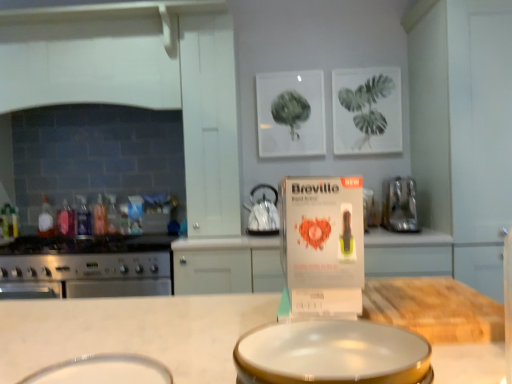
What is the approximate height of translucent plastic bottle at stove left, which is the 2th bottle in right-to-left order?

10.53 inches.

Image resolution: width=512 pixels, height=384 pixels. What do you see at coordinates (83, 218) in the screenshot?
I see `translucent plastic bottle at stove left, which appears as the 3th bottle when viewed from the left` at bounding box center [83, 218].

Identify the location of translucent plastic bottle at left, positioned as the 4th bottle in right-to-left order. The image size is (512, 384). (66, 220).

Find the location of a particular element. translucent plastic bottle at left, which is the fifth bottle from right to left is located at coordinates click(46, 220).

What is the approximate height of white glossy basin at center, marked as the first basin in a right-to-left arrangement?

white glossy basin at center, marked as the first basin in a right-to-left arrangement, is 12.31 centimeters tall.

What do you see at coordinates (263, 213) in the screenshot? I see `satin black kettle at center, positioned as the second kitchen appliance in right-to-left order` at bounding box center [263, 213].

Locate an element on the screen. The width and height of the screenshot is (512, 384). satin silver toaster at right, positioned as the 3th kitchen appliance in left-to-right order is located at coordinates (400, 206).

The width and height of the screenshot is (512, 384). What do you see at coordinates (113, 215) in the screenshot? I see `translucent plastic bottle at stove left, arranged as the first bottle when viewed from the right` at bounding box center [113, 215].

The width and height of the screenshot is (512, 384). Find the location of `translucent plastic bottle at stove left, marked as the 4th bottle in a left-to-right arrangement`. translucent plastic bottle at stove left, marked as the 4th bottle in a left-to-right arrangement is located at coordinates (100, 217).

Is white glossy basin at center, placed as the 2th basin when sorted from left to right, not near translucent plastic bottle at left, which is the fifth bottle from right to left?

Yes, white glossy basin at center, placed as the 2th basin when sorted from left to right, and translucent plastic bottle at left, which is the fifth bottle from right to left, are located far from each other.

Can we say white glossy basin at center, placed as the 2th basin when sorted from left to right, lies outside translucent plastic bottle at left, which is the fifth bottle from right to left?

white glossy basin at center, placed as the 2th basin when sorted from left to right, is positioned outside translucent plastic bottle at left, which is the fifth bottle from right to left.

From the image's perspective, is white glossy basin at center, marked as the first basin in a right-to-left arrangement, positioned above or below translucent plastic bottle at left, which is the fifth bottle from right to left?

white glossy basin at center, marked as the first basin in a right-to-left arrangement, is below translucent plastic bottle at left, which is the fifth bottle from right to left.

Does white glossy basin at center, placed as the 2th basin when sorted from left to right, have a lesser width compared to translucent plastic bottle at left, which is the fifth bottle from right to left?

In fact, white glossy basin at center, placed as the 2th basin when sorted from left to right, might be wider than translucent plastic bottle at left, which is the fifth bottle from right to left.

Is matte white box at center bigger than translucent plastic bottle at stove left, the 3th bottle in the right-to-left sequence?

Yes, matte white box at center is bigger than translucent plastic bottle at stove left, the 3th bottle in the right-to-left sequence.

Locate an element on the screen. This screenshot has width=512, height=384. cardboard box on the right of translucent plastic bottle at stove left, which appears as the 3th bottle when viewed from the left is located at coordinates (323, 244).

Is matte white box at center behind translucent plastic bottle at stove left, which appears as the 3th bottle when viewed from the left?

No.

Does point (361, 263) come farther from viewer compared to point (88, 213)?

No, (361, 263) is closer to viewer.

Is translucent plastic bottle at left, which is the fifth bottle from right to left, facing away from translucent plastic bottle at stove left, arranged as the first bottle when viewed from the right?

No, translucent plastic bottle at left, which is the fifth bottle from right to left,'s orientation is not away from translucent plastic bottle at stove left, arranged as the first bottle when viewed from the right.

Which is more to the left, translucent plastic bottle at left, placed as the first bottle when sorted from left to right, or translucent plastic bottle at stove left, arranged as the first bottle when viewed from the right?

Positioned to the left is translucent plastic bottle at left, placed as the first bottle when sorted from left to right.

From a real-world perspective, is translucent plastic bottle at left, placed as the first bottle when sorted from left to right, physically located above or below translucent plastic bottle at stove left, arranged as the first bottle when viewed from the right?

Clearly, from a real-world perspective, translucent plastic bottle at left, placed as the first bottle when sorted from left to right, is above translucent plastic bottle at stove left, arranged as the first bottle when viewed from the right.

Are stainless steel oven at left, the 1th kitchen appliance viewed from the left, and translucent plastic bottle at stove left, which is the 2th bottle in right-to-left order, far apart?

stainless steel oven at left, the 1th kitchen appliance viewed from the left, is near translucent plastic bottle at stove left, which is the 2th bottle in right-to-left order, not far away.

Is stainless steel oven at left, which appears as the third kitchen appliance when viewed from the right, to the left or to the right of translucent plastic bottle at stove left, marked as the 4th bottle in a left-to-right arrangement, in the image?

From the image, it's evident that stainless steel oven at left, which appears as the third kitchen appliance when viewed from the right, is to the right of translucent plastic bottle at stove left, marked as the 4th bottle in a left-to-right arrangement.

Is stainless steel oven at left, which appears as the third kitchen appliance when viewed from the right, in front of translucent plastic bottle at stove left, which is the 2th bottle in right-to-left order?

Yes, stainless steel oven at left, which appears as the third kitchen appliance when viewed from the right, is closer to the camera.

Measure the distance between translucent plastic bottle at stove left, which appears as the 3th bottle when viewed from the left, and translucent plastic bottle at left, the second bottle from the left.

translucent plastic bottle at stove left, which appears as the 3th bottle when viewed from the left, is 6.50 centimeters from translucent plastic bottle at left, the second bottle from the left.

Considering the positions of objects translucent plastic bottle at stove left, the 3th bottle in the right-to-left sequence, and translucent plastic bottle at left, the second bottle from the left, in the image provided, who is more to the left, translucent plastic bottle at stove left, the 3th bottle in the right-to-left sequence, or translucent plastic bottle at left, the second bottle from the left,?

translucent plastic bottle at left, the second bottle from the left.

Where is `the 4th bottle above when counting from the translucent plastic bottle at left, the second bottle from the left (from the image's perspective)`? the 4th bottle above when counting from the translucent plastic bottle at left, the second bottle from the left (from the image's perspective) is located at coordinates (83, 218).

Who is shorter, translucent plastic bottle at stove left, the 3th bottle in the right-to-left sequence, or translucent plastic bottle at left, the second bottle from the left?

Standing shorter between the two is translucent plastic bottle at left, the second bottle from the left.

Can you confirm if satin silver toaster at right, positioned as the 3th kitchen appliance in left-to-right order, is thinner than satin black kettle at center, which is counted as the 2th kitchen appliance, starting from the left?

In fact, satin silver toaster at right, positioned as the 3th kitchen appliance in left-to-right order, might be wider than satin black kettle at center, which is counted as the 2th kitchen appliance, starting from the left.

Considering the relative sizes of satin silver toaster at right, positioned as the 3th kitchen appliance in left-to-right order, and satin black kettle at center, positioned as the second kitchen appliance in right-to-left order, in the image provided, is satin silver toaster at right, positioned as the 3th kitchen appliance in left-to-right order, bigger than satin black kettle at center, positioned as the second kitchen appliance in right-to-left order,?

Correct, satin silver toaster at right, positioned as the 3th kitchen appliance in left-to-right order, is larger in size than satin black kettle at center, positioned as the second kitchen appliance in right-to-left order.

Considering their positions, is satin silver toaster at right, which is counted as the first kitchen appliance, starting from the right, located in front of or behind satin black kettle at center, positioned as the second kitchen appliance in right-to-left order?

satin silver toaster at right, which is counted as the first kitchen appliance, starting from the right, is positioned closer to the viewer than satin black kettle at center, positioned as the second kitchen appliance in right-to-left order.

Can you confirm if satin silver toaster at right, which is counted as the first kitchen appliance, starting from the right, is shorter than satin black kettle at center, positioned as the second kitchen appliance in right-to-left order?

In fact, satin silver toaster at right, which is counted as the first kitchen appliance, starting from the right, may be taller than satin black kettle at center, positioned as the second kitchen appliance in right-to-left order.

Looking at this image, in terms of height, does matte white box at center look taller or shorter compared to translucent plastic bottle at left, placed as the first bottle when sorted from left to right?

Clearly, matte white box at center is shorter compared to translucent plastic bottle at left, placed as the first bottle when sorted from left to right.

Is matte white box at center situated inside translucent plastic bottle at left, which is the fifth bottle from right to left, or outside?

matte white box at center is not inside translucent plastic bottle at left, which is the fifth bottle from right to left, it's outside.

Is matte white box at center facing towards translucent plastic bottle at left, placed as the first bottle when sorted from left to right?

No, matte white box at center is not oriented towards translucent plastic bottle at left, placed as the first bottle when sorted from left to right.

Is matte white box at center not close to translucent plastic bottle at left, placed as the first bottle when sorted from left to right?

Indeed, matte white box at center is not near translucent plastic bottle at left, placed as the first bottle when sorted from left to right.

Starting from the translucent plastic bottle at left, placed as the first bottle when sorted from left to right, which basin is the 2nd one to the right? Please provide its 2D coordinates.

[(331, 353)]

In order to click on cardboard box in front of the translucent plastic bottle at stove left, which appears as the 3th bottle when viewed from the left in this screenshot , I will do `click(323, 244)`.

When comparing their distances from white glossy basin at center, marked as the first basin in a right-to-left arrangement, does translucent plastic bottle at left, the second bottle from the left, or translucent plastic bottle at left, which is the fifth bottle from right to left, seem closer?

Based on the image, translucent plastic bottle at left, the second bottle from the left, appears to be nearer to white glossy basin at center, marked as the first basin in a right-to-left arrangement.

Considering their positions, is translucent plastic bottle at stove left, arranged as the first bottle when viewed from the right, positioned closer to white glossy basin at center, marked as the first basin in a right-to-left arrangement, than stainless steel oven at left, which appears as the third kitchen appliance when viewed from the right?

The object closer to white glossy basin at center, marked as the first basin in a right-to-left arrangement, is stainless steel oven at left, which appears as the third kitchen appliance when viewed from the right.

When comparing their distances from stainless steel oven at left, which appears as the third kitchen appliance when viewed from the right, does translucent plastic bottle at left, which is the fifth bottle from right to left, or translucent plastic bottle at left, the second bottle from the left, seem closer?

The object closer to stainless steel oven at left, which appears as the third kitchen appliance when viewed from the right, is translucent plastic bottle at left, the second bottle from the left.

Estimate the real-world distances between objects in this image. Which object is further from translucent plastic bottle at stove left, which is the 2th bottle in right-to-left order, translucent plastic bottle at stove left, the fifth bottle positioned from the left, or translucent plastic bottle at left, placed as the first bottle when sorted from left to right?

translucent plastic bottle at left, placed as the first bottle when sorted from left to right, is further to translucent plastic bottle at stove left, which is the 2th bottle in right-to-left order.

Looking at the image, which one is located closer to matte white box at center, translucent plastic bottle at stove left, which is the 2th bottle in right-to-left order, or translucent plastic bottle at left, placed as the first bottle when sorted from left to right?

Based on the image, translucent plastic bottle at stove left, which is the 2th bottle in right-to-left order, appears to be nearer to matte white box at center.

Which object lies nearer to the anchor point translucent plastic bottle at left, which is the fifth bottle from right to left, white glossy basin at lower center, which ranks as the 2th basin in right-to-left order, or matte white box at center?

matte white box at center lies closer to translucent plastic bottle at left, which is the fifth bottle from right to left, than the other object.

Estimate the real-world distances between objects in this image. Which object is further from white glossy basin at lower center, which ranks as the 2th basin in right-to-left order, white glossy basin at center, placed as the 2th basin when sorted from left to right, or translucent plastic bottle at stove left, which appears as the 3th bottle when viewed from the left?

translucent plastic bottle at stove left, which appears as the 3th bottle when viewed from the left, lies further to white glossy basin at lower center, which ranks as the 2th basin in right-to-left order, than the other object.

Estimate the real-world distances between objects in this image. Which object is closer to translucent plastic bottle at left, which is the fifth bottle from right to left, white glossy basin at lower center, which ranks as the first basin in left-to-right order, or satin silver toaster at right, positioned as the 3th kitchen appliance in left-to-right order?

The object closer to translucent plastic bottle at left, which is the fifth bottle from right to left, is satin silver toaster at right, positioned as the 3th kitchen appliance in left-to-right order.

At what (x,y) coordinates should I click in order to perform the action: click on basin between white glossy basin at center, marked as the first basin in a right-to-left arrangement, and translucent plastic bottle at stove left, the 3th bottle in the right-to-left sequence, in the front-back direction. Please return your answer as a coordinate pair (x, y). Looking at the image, I should click on [104, 370].

Find the location of a particular element. The image size is (512, 384). kitchen appliance between white glossy basin at lower center, which ranks as the 2th basin in right-to-left order, and satin silver toaster at right, which is counted as the first kitchen appliance, starting from the right, along the z-axis is located at coordinates (89, 266).

What are the coordinates of `cardboard box between white glossy basin at lower center, which ranks as the first basin in left-to-right order, and translucent plastic bottle at stove left, the 3th bottle in the right-to-left sequence, in the front-back direction` in the screenshot? It's located at tap(323, 244).

At what (x,y) coordinates should I click in order to perform the action: click on cardboard box between white glossy basin at center, marked as the first basin in a right-to-left arrangement, and satin silver toaster at right, positioned as the 3th kitchen appliance in left-to-right order, along the z-axis. Please return your answer as a coordinate pair (x, y). The image size is (512, 384). Looking at the image, I should click on (323, 244).